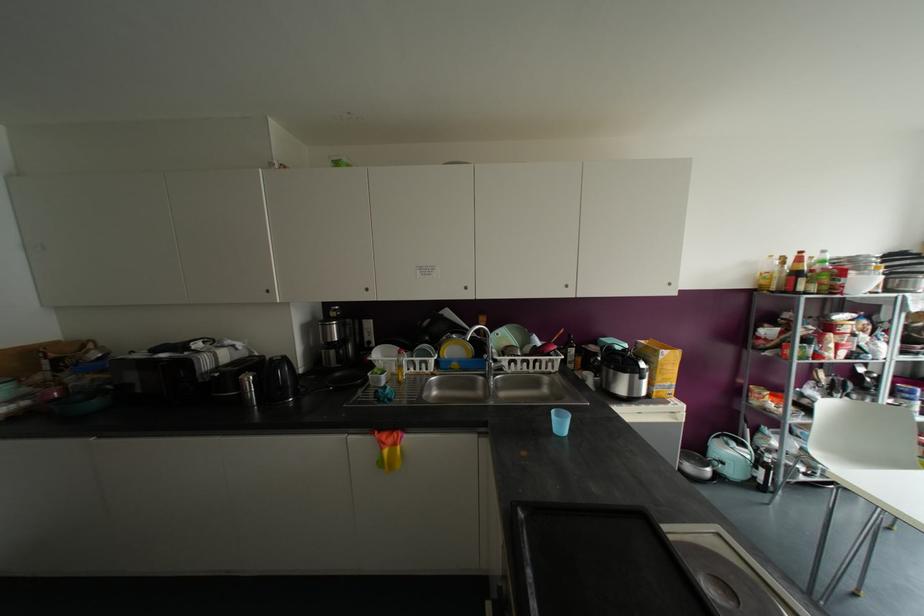
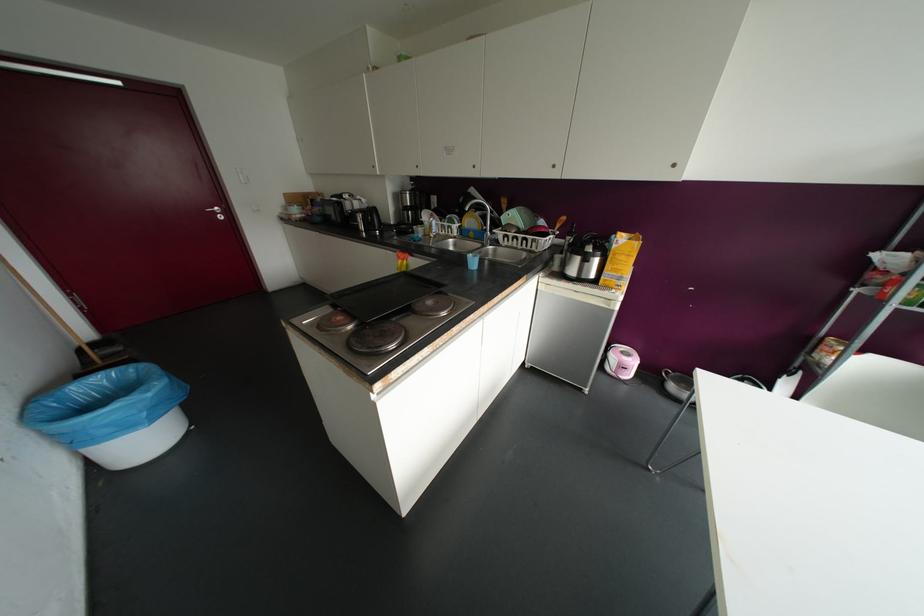
Find the pixel in the second image that matches (669,284) in the first image.

(673, 164)